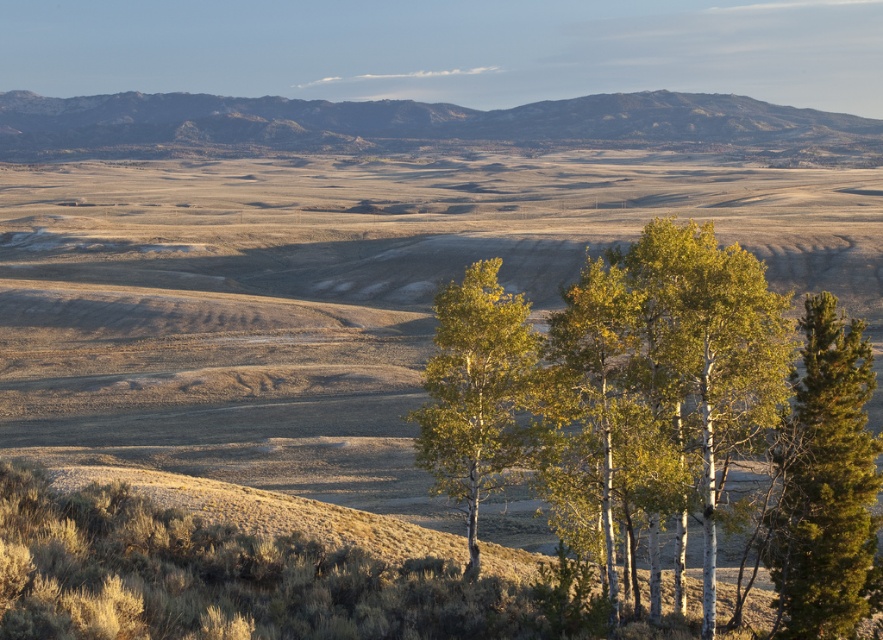
Based on the photo, can you confirm if green bark trees at center is taller than rocky brown mountain at upper center?

No, green bark trees at center is not taller than rocky brown mountain at upper center.

Does green bark trees at center appear on the right side of rocky brown mountain at upper center?

Indeed, green bark trees at center is positioned on the right side of rocky brown mountain at upper center.

Measure the distance between point (843, 486) and camera.

Point (843, 486) and camera are 43.46 meters apart from each other.

Where is `green bark trees at center`? This screenshot has height=640, width=883. green bark trees at center is located at coordinates (669, 412).

Is green bark trees at center smaller than green leafy birch at center?

Indeed, green bark trees at center has a smaller size compared to green leafy birch at center.

Between point (873, 532) and point (468, 268), which one is positioned behind?

The point (468, 268) is behind.

Locate an element on the screen. This screenshot has width=883, height=640. green bark trees at center is located at coordinates (669, 412).

Between rocky brown mountain at upper center and green textured pine tree at right, which one is positioned lower?

green textured pine tree at right is below.

Who is taller, rocky brown mountain at upper center or green textured pine tree at right?

Standing taller between the two is rocky brown mountain at upper center.

Is point (632, 131) in front of point (809, 582)?

That is False.

The width and height of the screenshot is (883, 640). What are the coordinates of `rocky brown mountain at upper center` in the screenshot? It's located at (412, 124).